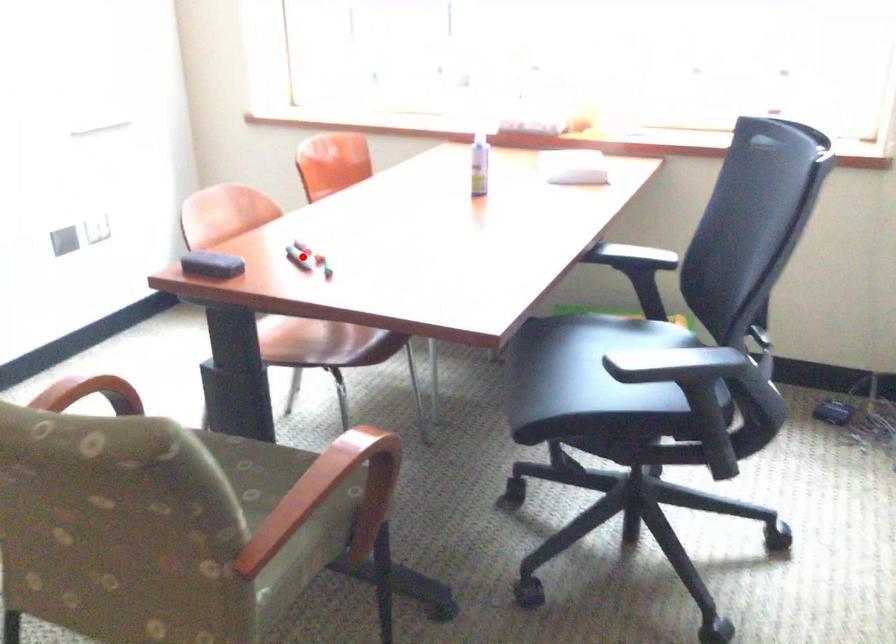
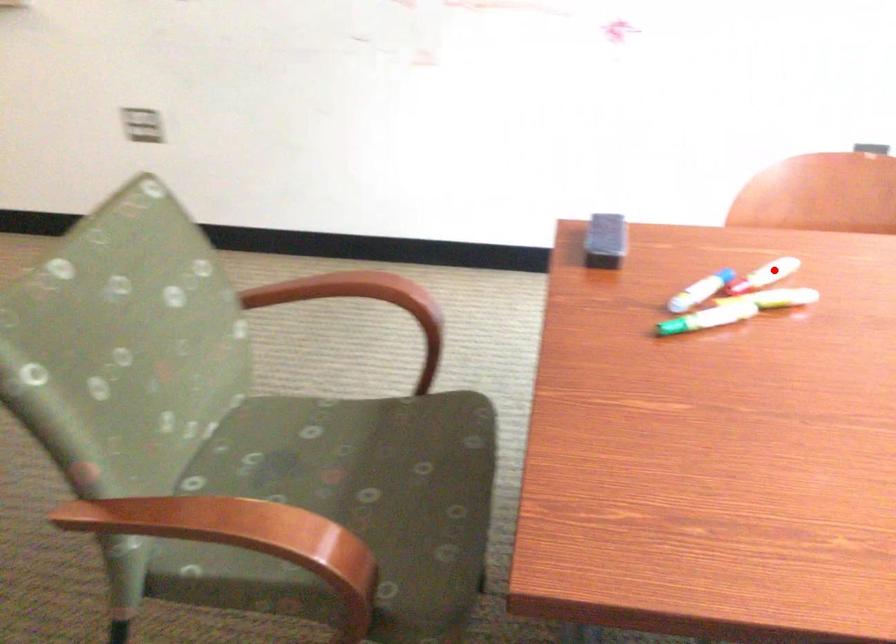
I am providing you with two images of the same scene from different viewpoints. A red point is marked on the first image and another point is marked on the second image. Is the marked point in image1 the same physical position as the marked point in image2?

No